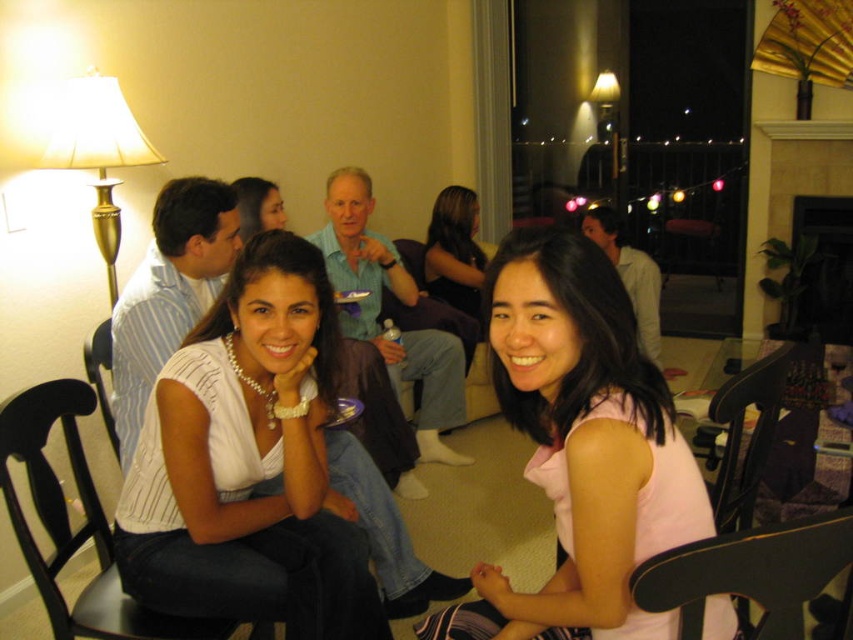
Question: Which of the following is the closest to the observer?

Choices:
 (A) (102, 353)
 (B) (328, 321)
 (C) (512, 346)
 (D) (451, 188)

Answer: (C)

Question: Does white pearl necklace at center lie behind matte black hair at center?

Choices:
 (A) yes
 (B) no

Answer: (B)

Question: Which object is closer to the camera taking this photo?

Choices:
 (A) smooth brown hair at center
 (B) white pearl necklace at center
 (C) pink fabric dress at center

Answer: (C)

Question: Does smooth brown hair at center appear over black leather chair at lower left?

Choices:
 (A) no
 (B) yes

Answer: (B)

Question: Which object is closer to the camera taking this photo?

Choices:
 (A) black wood chair at lower left
 (B) pink fabric dress at center

Answer: (B)

Question: Observing the image, what is the correct spatial positioning of black wood chair at lower left in reference to black leather chair at lower right?

Choices:
 (A) above
 (B) below

Answer: (B)